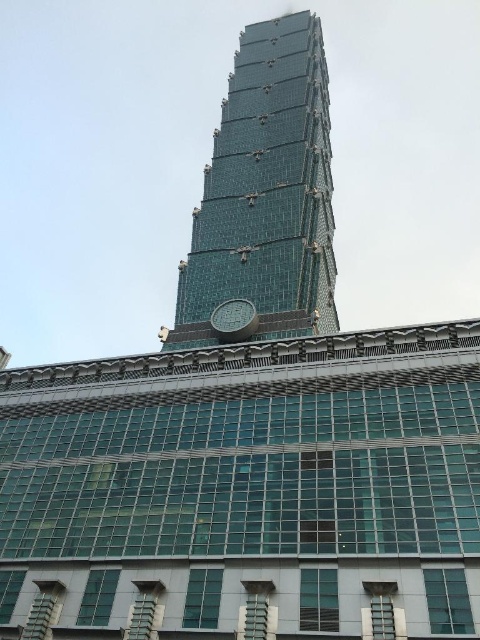
Is transparent glass tower at center thinner than metallic clock at center?

No, transparent glass tower at center is not thinner than metallic clock at center.

Describe the element at coordinates (265, 193) in the screenshot. I see `transparent glass tower at center` at that location.

The image size is (480, 640). What do you see at coordinates (265, 193) in the screenshot? I see `transparent glass tower at center` at bounding box center [265, 193].

Image resolution: width=480 pixels, height=640 pixels. Identify the location of transparent glass tower at center. (265, 193).